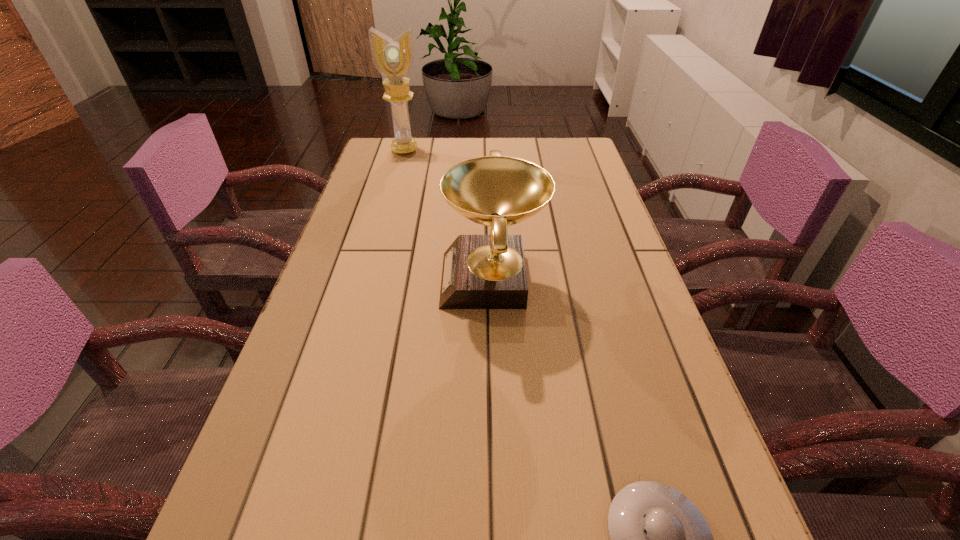
Locate an element on the screen. This screenshot has height=540, width=960. object that is positioned at the far left corner is located at coordinates (393, 58).

The width and height of the screenshot is (960, 540). I want to click on free space at the left edge, so click(384, 213).

Find the location of a particular element. The image size is (960, 540). blank space at the right edge of the desktop is located at coordinates (622, 240).

This screenshot has width=960, height=540. I want to click on vacant space at the far left corner of the desktop, so click(391, 152).

The image size is (960, 540). In the image, there is a desktop. Find the location of `vacant area at the far right corner`. vacant area at the far right corner is located at coordinates (591, 170).

Image resolution: width=960 pixels, height=540 pixels. Identify the location of empty space that is in between the nearer award and the farthest object. (448, 215).

Where is `free spot between the shorter award and the farthest object`? The width and height of the screenshot is (960, 540). free spot between the shorter award and the farthest object is located at coordinates (448, 215).

Where is `free space between the tallest object and the second shortest object`? This screenshot has height=540, width=960. free space between the tallest object and the second shortest object is located at coordinates (448, 215).

Identify which object is the closest to the second tallest object. Please provide its 2D coordinates. Your answer should be formatted as a tuple, i.e. [(x, y)], where the tuple contains the x and y coordinates of a point satisfying the conditions above.

[(659, 539)]

The height and width of the screenshot is (540, 960). Find the location of `object that can be found as the closest to the taller award`. object that can be found as the closest to the taller award is located at coordinates (479, 271).